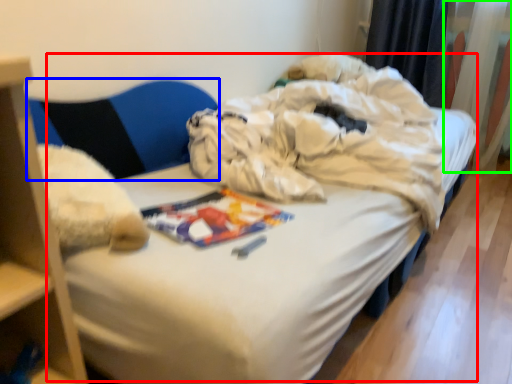
Question: Considering the real-world distances, which object is closest to bed (highlighted by a red box)? armchair (highlighted by a blue box) or curtain (highlighted by a green box).

Choices:
 (A) armchair
 (B) curtain

Answer: (A)